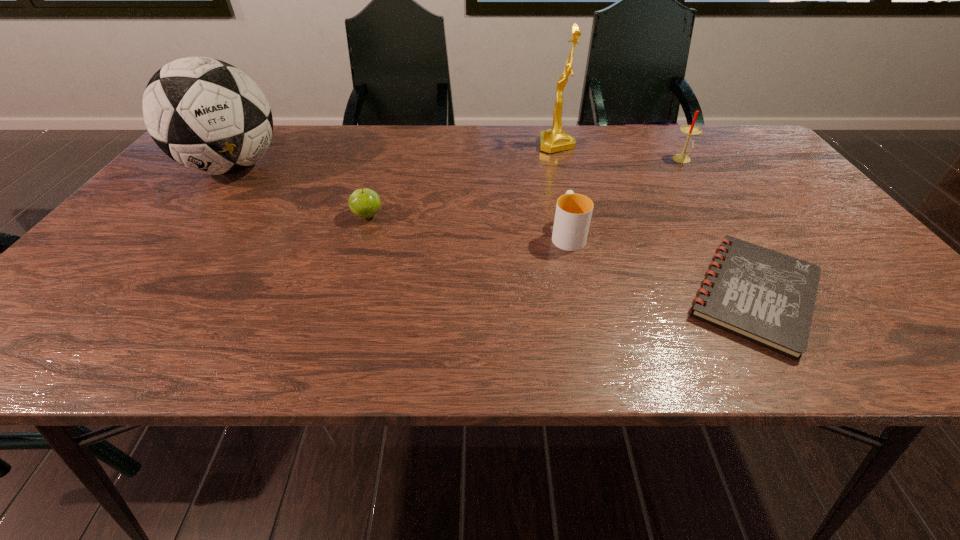
Find the location of `object that is at the near edge`. object that is at the near edge is located at coordinates (761, 295).

You are a GUI agent. You are given a task and a screenshot of the screen. Output one action in this format:
    pyautogui.click(x=<x>, y=<y>)
    Task: Click on the object located in the left edge section of the desktop
    The width and height of the screenshot is (960, 540).
    Given the screenshot: What is the action you would take?
    pyautogui.click(x=207, y=115)

Identify the location of object present at the right edge. (761, 295).

Locate an element on the screen. object at the far left corner is located at coordinates (207, 115).

Identify the location of object that is positioned at the near right corner. The height and width of the screenshot is (540, 960). (761, 295).

Where is `free space at the far edge of the desktop`? free space at the far edge of the desktop is located at coordinates (684, 137).

You are a GUI agent. You are given a task and a screenshot of the screen. Output one action in this format:
    pyautogui.click(x=<x>, y=<y>)
    Task: Click on the free space at the near edge
    The height and width of the screenshot is (540, 960).
    Given the screenshot: What is the action you would take?
    pyautogui.click(x=435, y=347)

Where is `free space at the left edge`? The image size is (960, 540). free space at the left edge is located at coordinates (152, 211).

You are a GUI agent. You are given a task and a screenshot of the screen. Output one action in this format:
    pyautogui.click(x=<x>, y=<y>)
    Task: Click on the blank space at the right edge of the desktop
    
    Given the screenshot: What is the action you would take?
    pyautogui.click(x=850, y=305)

Find the location of a particular element. This screenshot has width=960, height=540. blank space at the near right corner of the desktop is located at coordinates coord(859,327).